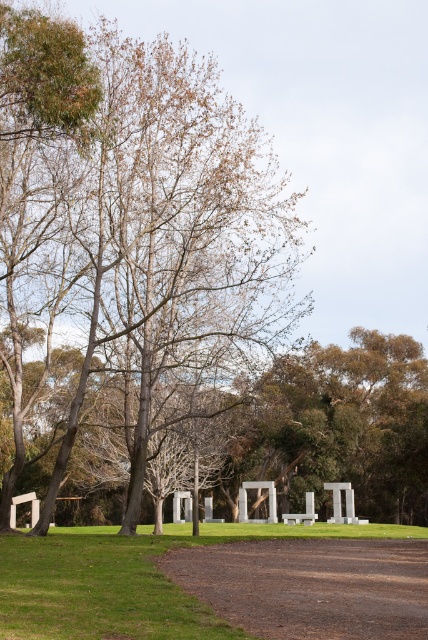
Question: Among these objects, which one is farthest from the camera?

Choices:
 (A) brown leafy tree at center
 (B) brown dirt path at lower center

Answer: (A)

Question: Does brown leafy tree at center have a greater width compared to brown dirt path at lower center?

Choices:
 (A) yes
 (B) no

Answer: (A)

Question: Is brown leafy tree at center below brown dirt path at lower center?

Choices:
 (A) yes
 (B) no

Answer: (B)

Question: Which point is closer to the camera?

Choices:
 (A) (18, 413)
 (B) (306, 604)

Answer: (B)

Question: Is brown leafy tree at center above brown dirt path at lower center?

Choices:
 (A) yes
 (B) no

Answer: (A)